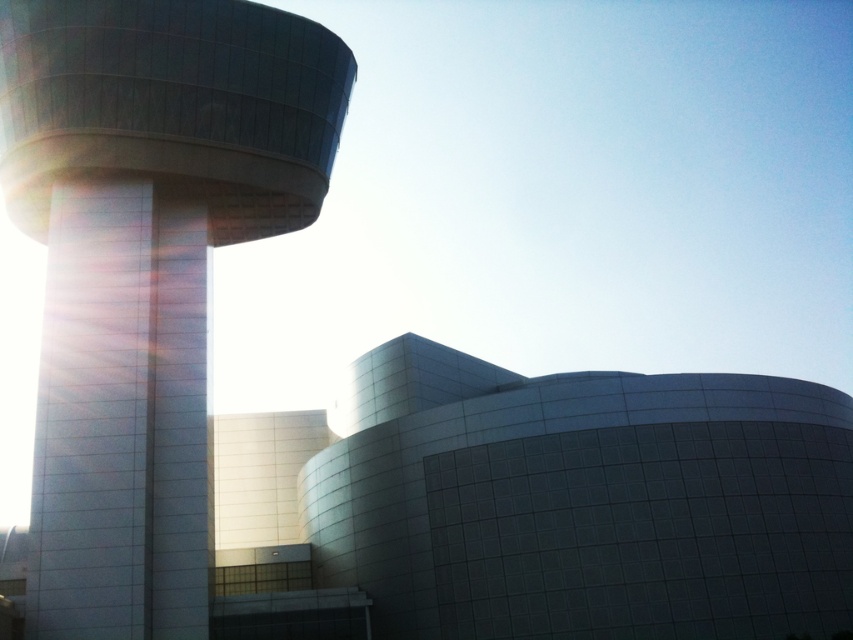
Which is above, smooth glass tower at left or white glossy pillar at left?

smooth glass tower at left is higher up.

Can you confirm if smooth glass tower at left is smaller than white glossy pillar at left?

No, smooth glass tower at left is not smaller than white glossy pillar at left.

Describe the element at coordinates (144, 268) in the screenshot. I see `smooth glass tower at left` at that location.

Find the location of `smooth glass tower at left`. smooth glass tower at left is located at coordinates (144, 268).